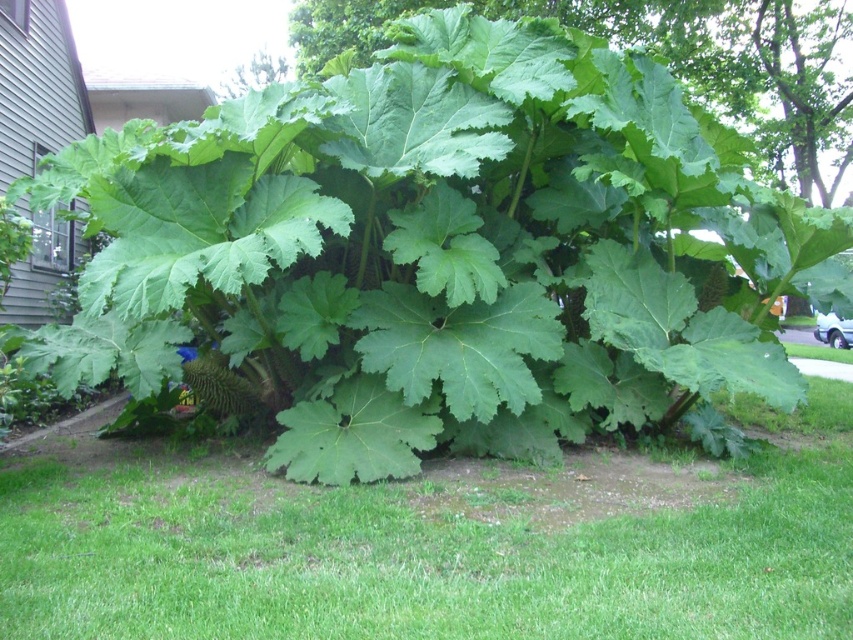
Question: Does green grass at center come in front of green leafy plant at center?

Choices:
 (A) no
 (B) yes

Answer: (B)

Question: Can you confirm if green grass at center is smaller than green leafy plant at center?

Choices:
 (A) no
 (B) yes

Answer: (B)

Question: Which point is closer to the camera taking this photo?

Choices:
 (A) (517, 8)
 (B) (302, 524)

Answer: (B)

Question: Which of the following is the farthest from the observer?

Choices:
 (A) green grass at center
 (B) green leafy plant at center

Answer: (B)

Question: Is green grass at center below green leafy plant at center?

Choices:
 (A) no
 (B) yes

Answer: (B)